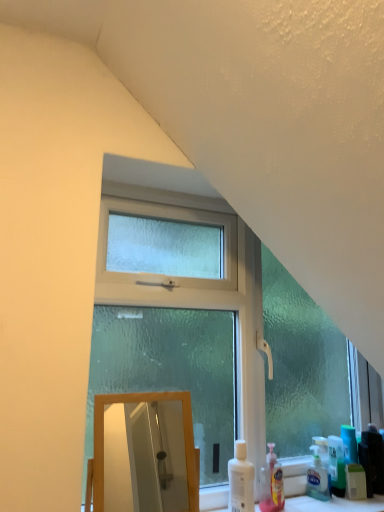
Identify the location of white plastic bottle at lower right, arranged as the first cleaning product when viewed from the left. (241, 480).

What do you see at coordinates (143, 457) in the screenshot?
I see `wooden mirror at lower left` at bounding box center [143, 457].

Describe the element at coordinates (272, 484) in the screenshot. I see `translucent plastic bottle at lower center, the 1th cleaning product in the right-to-left sequence` at that location.

I want to click on white plastic bottle at lower right, the 2th cleaning product when ordered from right to left, so click(x=241, y=480).

Considering the sizes of objects white plastic bottle at lower right, the 2th cleaning product when ordered from right to left, and translucent plastic bottle at lower center, marked as the second cleaning product in a left-to-right arrangement, in the image provided, who is smaller, white plastic bottle at lower right, the 2th cleaning product when ordered from right to left, or translucent plastic bottle at lower center, marked as the second cleaning product in a left-to-right arrangement,?

translucent plastic bottle at lower center, marked as the second cleaning product in a left-to-right arrangement, is smaller.

Image resolution: width=384 pixels, height=512 pixels. Find the location of `cleaning product on the left of translucent plastic bottle at lower center, marked as the second cleaning product in a left-to-right arrangement`. cleaning product on the left of translucent plastic bottle at lower center, marked as the second cleaning product in a left-to-right arrangement is located at coordinates (241, 480).

Is white plastic bottle at lower right, arranged as the first cleaning product when viewed from the left, oriented away from translucent plastic bottle at lower center, the 1th cleaning product in the right-to-left sequence?

No, white plastic bottle at lower right, arranged as the first cleaning product when viewed from the left,'s orientation is not away from translucent plastic bottle at lower center, the 1th cleaning product in the right-to-left sequence.

Considering the relative positions of white plastic bottle at lower right, the 2th cleaning product when ordered from right to left, and translucent plastic bottle at lower center, marked as the second cleaning product in a left-to-right arrangement, in the image provided, is white plastic bottle at lower right, the 2th cleaning product when ordered from right to left, to the left or to the right of translucent plastic bottle at lower center, marked as the second cleaning product in a left-to-right arrangement,?

Clearly, white plastic bottle at lower right, the 2th cleaning product when ordered from right to left, is on the left of translucent plastic bottle at lower center, marked as the second cleaning product in a left-to-right arrangement, in the image.

Is wooden mirror at lower left outside of white plastic bottle at lower right, the 2th cleaning product when ordered from right to left?

Yes, wooden mirror at lower left is located beyond the bounds of white plastic bottle at lower right, the 2th cleaning product when ordered from right to left.

From a real-world perspective, is wooden mirror at lower left beneath white plastic bottle at lower right, arranged as the first cleaning product when viewed from the left?

No.

Who is bigger, wooden mirror at lower left or white plastic bottle at lower right, arranged as the first cleaning product when viewed from the left?

wooden mirror at lower left.

Are translucent plastic bottle at lower center, the 1th cleaning product in the right-to-left sequence, and frosted glass window at center far apart?

No, there isn't a large distance between translucent plastic bottle at lower center, the 1th cleaning product in the right-to-left sequence, and frosted glass window at center.

Which of these two, translucent plastic bottle at lower center, the 1th cleaning product in the right-to-left sequence, or frosted glass window at center, is thinner?

Thinner between the two is translucent plastic bottle at lower center, the 1th cleaning product in the right-to-left sequence.

Find the location of a particular element. The width and height of the screenshot is (384, 512). the 2nd cleaning product directly beneath the frosted glass window at center (from a real-world perspective) is located at coordinates (272, 484).

Is translucent plastic bottle at lower center, the 1th cleaning product in the right-to-left sequence, positioned with its back to frosted glass window at center?

Yes, frosted glass window at center is at the back of translucent plastic bottle at lower center, the 1th cleaning product in the right-to-left sequence.

From the image's perspective, between frosted glass window at center and wooden mirror at lower left, which one is located above?

From the image's view, frosted glass window at center is above.

At what (x,y) coordinates should I click in order to perform the action: click on mirror below the frosted glass window at center (from the image's perspective). Please return your answer as a coordinate pair (x, y). The width and height of the screenshot is (384, 512). Looking at the image, I should click on (143, 457).

Which of these two, frosted glass window at center or wooden mirror at lower left, stands shorter?

Standing shorter between the two is wooden mirror at lower left.

From a real-world perspective, is frosted glass window at center above or below wooden mirror at lower left?

frosted glass window at center is above wooden mirror at lower left.

Which of these two, wooden mirror at lower left or translucent plastic bottle at lower center, the 1th cleaning product in the right-to-left sequence, is wider?

With larger width is wooden mirror at lower left.

Is wooden mirror at lower left oriented towards translucent plastic bottle at lower center, marked as the second cleaning product in a left-to-right arrangement?

No, wooden mirror at lower left is not aimed at translucent plastic bottle at lower center, marked as the second cleaning product in a left-to-right arrangement.

Which is correct: wooden mirror at lower left is inside translucent plastic bottle at lower center, marked as the second cleaning product in a left-to-right arrangement, or outside of it?

wooden mirror at lower left is located beyond the bounds of translucent plastic bottle at lower center, marked as the second cleaning product in a left-to-right arrangement.

Can you confirm if frosted glass window at center is smaller than white plastic bottle at lower right, the 2th cleaning product when ordered from right to left?

Incorrect, frosted glass window at center is not smaller in size than white plastic bottle at lower right, the 2th cleaning product when ordered from right to left.

Could white plastic bottle at lower right, the 2th cleaning product when ordered from right to left, be considered to be inside frosted glass window at center?

No, white plastic bottle at lower right, the 2th cleaning product when ordered from right to left, is located outside of frosted glass window at center.

Is frosted glass window at center at the left side of white plastic bottle at lower right, the 2th cleaning product when ordered from right to left?

No, frosted glass window at center is not to the left of white plastic bottle at lower right, the 2th cleaning product when ordered from right to left.

Is frosted glass window at center turned away from white plastic bottle at lower right, the 2th cleaning product when ordered from right to left?

Yes, frosted glass window at center's orientation is away from white plastic bottle at lower right, the 2th cleaning product when ordered from right to left.

From the image's perspective, is translucent plastic bottle at lower center, marked as the second cleaning product in a left-to-right arrangement, on top of white plastic bottle at lower right, the 2th cleaning product when ordered from right to left?

No, from the image's perspective, translucent plastic bottle at lower center, marked as the second cleaning product in a left-to-right arrangement, is not on top of white plastic bottle at lower right, the 2th cleaning product when ordered from right to left.

Between translucent plastic bottle at lower center, marked as the second cleaning product in a left-to-right arrangement, and white plastic bottle at lower right, arranged as the first cleaning product when viewed from the left, which one appears on the left side from the viewer's perspective?

white plastic bottle at lower right, arranged as the first cleaning product when viewed from the left, is more to the left.

Looking at their sizes, would you say translucent plastic bottle at lower center, the 1th cleaning product in the right-to-left sequence, is wider or thinner than white plastic bottle at lower right, the 2th cleaning product when ordered from right to left?

Clearly, translucent plastic bottle at lower center, the 1th cleaning product in the right-to-left sequence, has less width compared to white plastic bottle at lower right, the 2th cleaning product when ordered from right to left.

Does point (272, 486) lie in front of point (242, 473)?

No, (272, 486) is further to viewer.

Identify the location of cleaning product lying below the white plastic bottle at lower right, arranged as the first cleaning product when viewed from the left (from the image's perspective). (272, 484).

The height and width of the screenshot is (512, 384). Find the location of `mirror above the white plastic bottle at lower right, the 2th cleaning product when ordered from right to left (from a real-world perspective)`. mirror above the white plastic bottle at lower right, the 2th cleaning product when ordered from right to left (from a real-world perspective) is located at coordinates pyautogui.click(x=143, y=457).

Looking at the image, which one is located further to translucent plastic bottle at lower center, the 1th cleaning product in the right-to-left sequence, white plastic bottle at lower right, arranged as the first cleaning product when viewed from the left, or frosted glass window at center?

frosted glass window at center.

From the image, which object appears to be nearer to wooden mirror at lower left, translucent plastic bottle at lower center, marked as the second cleaning product in a left-to-right arrangement, or frosted glass window at center?

Among the two, frosted glass window at center is located nearer to wooden mirror at lower left.

From the image, which object appears to be nearer to frosted glass window at center, wooden mirror at lower left or white plastic bottle at lower right, the 2th cleaning product when ordered from right to left?

Among the two, white plastic bottle at lower right, the 2th cleaning product when ordered from right to left, is located nearer to frosted glass window at center.

When comparing their distances from wooden mirror at lower left, does white plastic bottle at lower right, arranged as the first cleaning product when viewed from the left, or translucent plastic bottle at lower center, the 1th cleaning product in the right-to-left sequence, seem closer?

The object closer to wooden mirror at lower left is white plastic bottle at lower right, arranged as the first cleaning product when viewed from the left.

From the picture: When comparing their distances from translucent plastic bottle at lower center, the 1th cleaning product in the right-to-left sequence, does frosted glass window at center or white plastic bottle at lower right, the 2th cleaning product when ordered from right to left, seem closer?

white plastic bottle at lower right, the 2th cleaning product when ordered from right to left, is positioned closer to the anchor translucent plastic bottle at lower center, the 1th cleaning product in the right-to-left sequence.

When comparing their distances from translucent plastic bottle at lower center, the 1th cleaning product in the right-to-left sequence, does white plastic bottle at lower right, the 2th cleaning product when ordered from right to left, or wooden mirror at lower left seem closer?

white plastic bottle at lower right, the 2th cleaning product when ordered from right to left, lies closer to translucent plastic bottle at lower center, the 1th cleaning product in the right-to-left sequence, than the other object.

Estimate the real-world distances between objects in this image. Which object is closer to frosted glass window at center, translucent plastic bottle at lower center, the 1th cleaning product in the right-to-left sequence, or wooden mirror at lower left?

translucent plastic bottle at lower center, the 1th cleaning product in the right-to-left sequence, is closer to frosted glass window at center.

Based on their spatial positions, is white plastic bottle at lower right, the 2th cleaning product when ordered from right to left, or translucent plastic bottle at lower center, marked as the second cleaning product in a left-to-right arrangement, further from frosted glass window at center?

translucent plastic bottle at lower center, marked as the second cleaning product in a left-to-right arrangement.

You are a GUI agent. You are given a task and a screenshot of the screen. Output one action in this format:
    pyautogui.click(x=<x>, y=<y>)
    Task: Click on the cleaning product between wooden mirror at lower left and translucent plastic bottle at lower center, the 1th cleaning product in the right-to-left sequence
    
    Given the screenshot: What is the action you would take?
    pyautogui.click(x=241, y=480)

This screenshot has width=384, height=512. What are the coordinates of `cleaning product between frosted glass window at center and translucent plastic bottle at lower center, the 1th cleaning product in the right-to-left sequence, from top to bottom` in the screenshot? It's located at (241, 480).

Image resolution: width=384 pixels, height=512 pixels. I want to click on window situated between wooden mirror at lower left and translucent plastic bottle at lower center, marked as the second cleaning product in a left-to-right arrangement, from left to right, so click(x=210, y=332).

Image resolution: width=384 pixels, height=512 pixels. Identify the location of cleaning product between wooden mirror at lower left and frosted glass window at center. (241, 480).